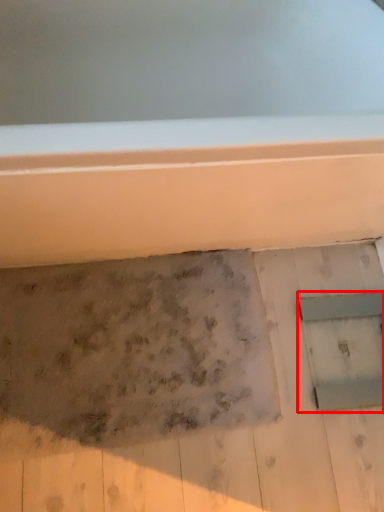
Question: From the image's perspective, what is the correct spatial positioning of window (annotated by the red box) in reference to footprint?

Choices:
 (A) above
 (B) below

Answer: (A)